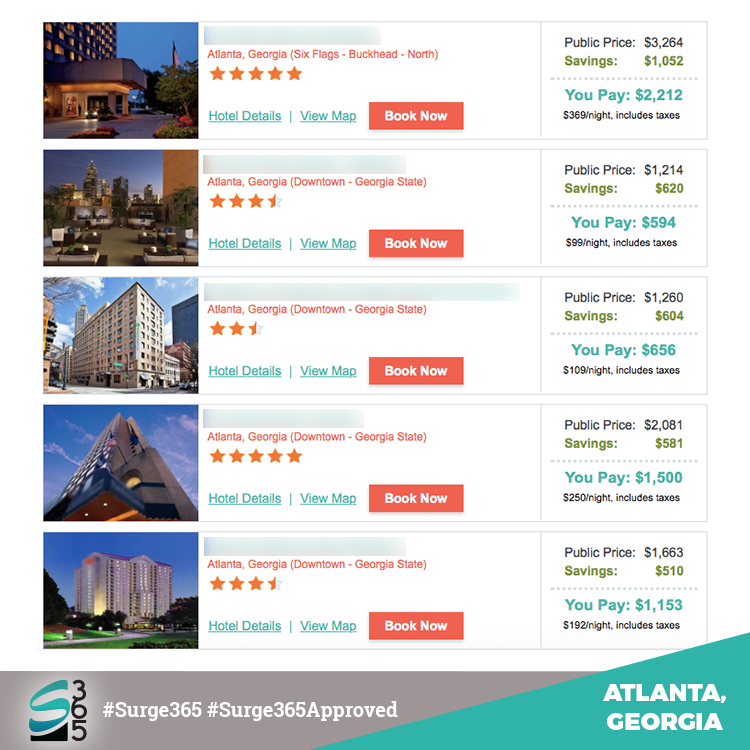
Where is `white space between photos`? white space between photos is located at coordinates (135, 142), (132, 525), (112, 398), (116, 268).